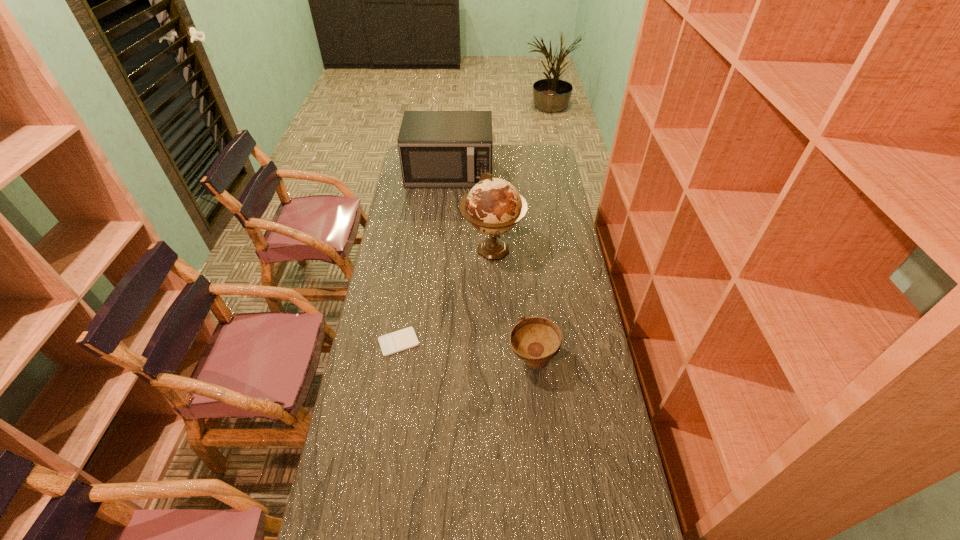
The width and height of the screenshot is (960, 540). In order to click on blank region between the third shortest object and the calculator in this screenshot , I will do `click(424, 257)`.

This screenshot has width=960, height=540. Find the location of `free spot between the third nearest object and the soup bowl`. free spot between the third nearest object and the soup bowl is located at coordinates (513, 305).

You are a GUI agent. You are given a task and a screenshot of the screen. Output one action in this format:
    pyautogui.click(x=<x>, y=<y>)
    Task: Click on the free space that is in between the tallest object and the shortest object
    The image size is (960, 540).
    Given the screenshot: What is the action you would take?
    [x=445, y=296]

Locate an element on the screen. This screenshot has height=540, width=960. free space between the calculator and the farthest object is located at coordinates (424, 257).

Where is `vacant space that's between the third nearest object and the second shortest object`? Image resolution: width=960 pixels, height=540 pixels. vacant space that's between the third nearest object and the second shortest object is located at coordinates (513, 305).

You are a GUI agent. You are given a task and a screenshot of the screen. Output one action in this format:
    pyautogui.click(x=<x>, y=<y>)
    Task: Click on the free space between the microwave oven and the soup bowl
    
    Given the screenshot: What is the action you would take?
    pyautogui.click(x=491, y=266)

This screenshot has height=540, width=960. In order to click on free space between the third tallest object and the farthest object in this screenshot , I will do `click(491, 266)`.

The image size is (960, 540). What are the coordinates of `free spot between the shortest object and the second shortest object` in the screenshot? It's located at (466, 351).

I want to click on the closest object relative to the microwave oven, so click(x=494, y=206).

Identify the location of object that can be found as the closest to the third shortest object. Image resolution: width=960 pixels, height=540 pixels. (494, 206).